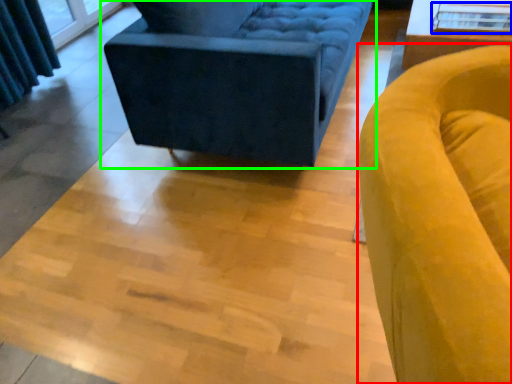
Question: Which object is positioned closest to chair (highlighted by a red box)? Select from glass table (highlighted by a blue box) and studio couch (highlighted by a green box).

Choices:
 (A) glass table
 (B) studio couch

Answer: (B)